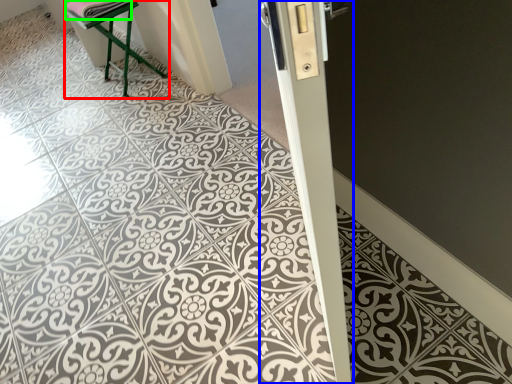
Question: Which object is the closest to the furniture (highlighted by a red box)? Choose among these: pillar (highlighted by a blue box) or material (highlighted by a green box).

Choices:
 (A) pillar
 (B) material

Answer: (B)